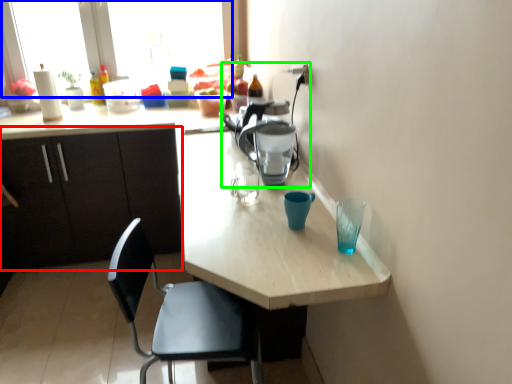
Question: Which object is the closest to the cabinetry (highlighted by a red box)? Choose among these: window screen (highlighted by a blue box) or coffeepot (highlighted by a green box).

Choices:
 (A) window screen
 (B) coffeepot

Answer: (A)